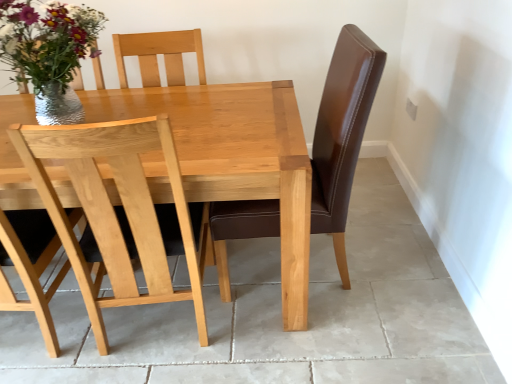
Locate an element on the screen. This screenshot has height=384, width=512. light wood chair at center is located at coordinates (120, 213).

What is the approximate height of light wood chair at center?

light wood chair at center is 98.65 centimeters in height.

What do you see at coordinates (120, 213) in the screenshot?
I see `light wood chair at center` at bounding box center [120, 213].

Measure the distance between point (54, 82) and camera.

The depth of point (54, 82) is 4.93 feet.

Identify the location of shiny metallic vase at upper left. (49, 53).

Describe the element at coordinates (49, 53) in the screenshot. I see `shiny metallic vase at upper left` at that location.

You are a GUI agent. You are given a task and a screenshot of the screen. Output one action in this format:
    pyautogui.click(x=<x>, y=<y>)
    Task: Click on the light wood chair at center
    The height and width of the screenshot is (384, 512).
    Given the screenshot: What is the action you would take?
    pyautogui.click(x=120, y=213)

Based on their positions, is light wood chair at center located to the left or right of shiny metallic vase at upper left?

Based on their positions, light wood chair at center is located to the right of shiny metallic vase at upper left.

From the picture: Is light wood chair at center closer to the viewer compared to shiny metallic vase at upper left?

Yes, the depth of light wood chair at center is less than that of shiny metallic vase at upper left.

Does point (78, 159) appear closer or farther from the camera than point (61, 14)?

Point (78, 159) appears to be closer to the viewer than point (61, 14).

From the image's perspective, which one is positioned higher, light wood chair at center or shiny metallic vase at upper left?

shiny metallic vase at upper left appears higher in the image.

From a real-world perspective, between light wood chair at center and shiny metallic vase at upper left, who is vertically higher?

shiny metallic vase at upper left.

Considering the relative sizes of light wood chair at center and shiny metallic vase at upper left in the image provided, is light wood chair at center wider than shiny metallic vase at upper left?

Indeed, light wood chair at center has a greater width compared to shiny metallic vase at upper left.

Looking at this image, can you confirm if light wood chair at center is taller than shiny metallic vase at upper left?

Correct, light wood chair at center is much taller as shiny metallic vase at upper left.

Considering the relative sizes of light wood chair at center and shiny metallic vase at upper left in the image provided, is light wood chair at center smaller than shiny metallic vase at upper left?

Incorrect, light wood chair at center is not smaller in size than shiny metallic vase at upper left.

Does light wood chair at center contain shiny metallic vase at upper left?

No, shiny metallic vase at upper left is not inside light wood chair at center.

Are light wood chair at center and shiny metallic vase at upper left making contact?

They are not placed beside each other.

From the picture: Could you tell me if light wood chair at center is turned towards shiny metallic vase at upper left?

No, light wood chair at center does not turn towards shiny metallic vase at upper left.

Locate an element on the screen. This screenshot has height=384, width=512. floral arrangement above the light wood chair at center (from a real-world perspective) is located at coordinates 49,53.

Is shiny metallic vase at upper left to the left or to the right of light wood chair at center in the image?

In the image, shiny metallic vase at upper left appears on the left side of light wood chair at center.

Is shiny metallic vase at upper left closer to camera compared to light wood chair at center?

No, shiny metallic vase at upper left is behind light wood chair at center.

Is point (27, 79) farther from viewer compared to point (126, 197)?

Yes, it is.

From the image's perspective, would you say shiny metallic vase at upper left is shown under light wood chair at center?

No, from the image's perspective, shiny metallic vase at upper left is not below light wood chair at center.

From a real-world perspective, is shiny metallic vase at upper left below light wood chair at center?

No.

Which object is thinner, shiny metallic vase at upper left or light wood chair at center?

Thinner between the two is shiny metallic vase at upper left.

Looking at this image, who is shorter, shiny metallic vase at upper left or light wood chair at center?

Standing shorter between the two is shiny metallic vase at upper left.

Can you confirm if shiny metallic vase at upper left is bigger than light wood chair at center?

No.

Do you think shiny metallic vase at upper left is within light wood chair at center, or outside of it?

shiny metallic vase at upper left is spatially situated outside light wood chair at center.

Is shiny metallic vase at upper left placed right next to light wood chair at center?

shiny metallic vase at upper left and light wood chair at center are not in contact.

Is shiny metallic vase at upper left aimed at light wood chair at center?

No, shiny metallic vase at upper left is not turned towards light wood chair at center.

Image resolution: width=512 pixels, height=384 pixels. I want to click on floral arrangement above the light wood chair at center (from a real-world perspective), so click(x=49, y=53).

I want to click on floral arrangement that is above the light wood chair at center (from the image's perspective), so click(49, 53).

Locate an element on the screen. The width and height of the screenshot is (512, 384). floral arrangement that appears above the light wood chair at center (from a real-world perspective) is located at coordinates (x=49, y=53).